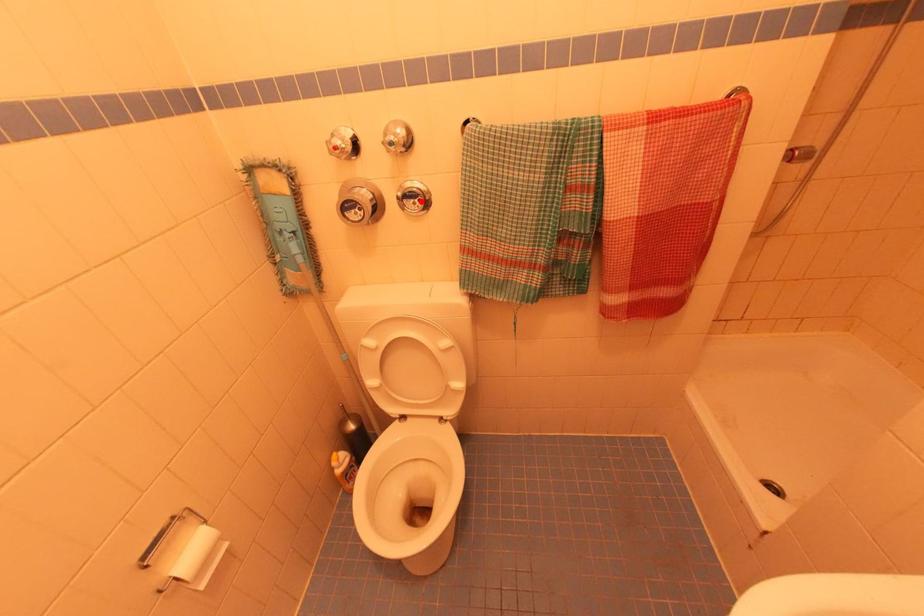
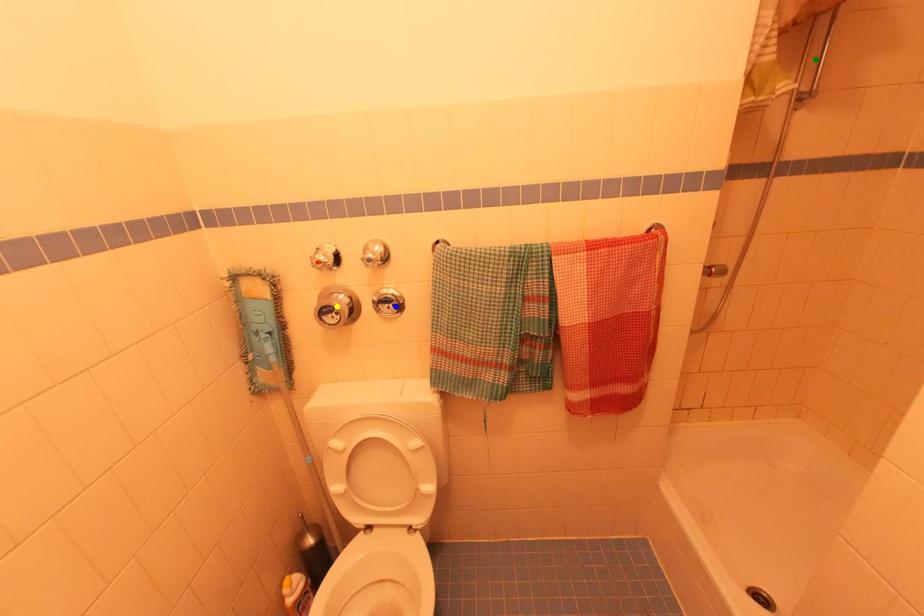
Question: I am providing you with two images of the same scene from different viewpoints. A red point is marked on the first image. You are given multiple points on the second image. Which spot in image 2 lines up with the point in image 1?

Choices:
 (A) blue point
 (B) green point
 (C) yellow point

Answer: (A)